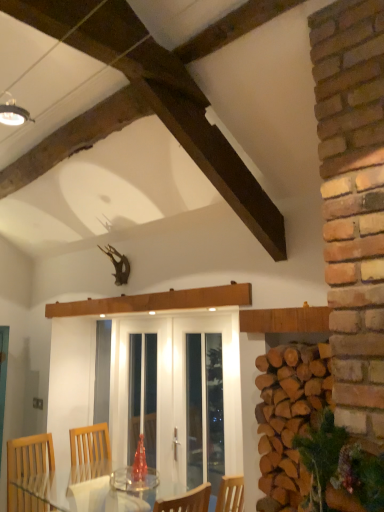
Identify the location of natural brown woodpile at right. (288, 419).

Describe the element at coordinates (204, 396) in the screenshot. I see `white glass door at center, the first screen door viewed from the right` at that location.

I want to click on white glass screen door at center, the 1th screen door positioned from the left, so click(x=178, y=394).

Is natural brown woodpile at right a part of white glass door at center, the first screen door viewed from the right?

No, natural brown woodpile at right is not a part of white glass door at center, the first screen door viewed from the right.

Based on their sizes in the image, would you say white glass door at center, the second screen door in the left-to-right sequence, is bigger or smaller than natural brown woodpile at right?

Considering their sizes, white glass door at center, the second screen door in the left-to-right sequence, takes up less space than natural brown woodpile at right.

From a real-world perspective, which screen door is the 1st one underneath the natural brown woodpile at right? Please provide its 2D coordinates.

[(204, 396)]

Is point (149, 368) less distant than point (288, 357)?

No.

From the picture: How many degrees apart are the facing directions of white glass screen door at center, the 2th screen door viewed from the right, and natural brown woodpile at right?

They differ by 0.137 degrees in their facing directions.

Is white glass screen door at center, the 1th screen door positioned from the left, bigger than natural brown woodpile at right?

Indeed, white glass screen door at center, the 1th screen door positioned from the left, has a larger size compared to natural brown woodpile at right.

Find the location of `screen door above the white glass screen door at center, the 1th screen door positioned from the left (from a real-world perspective)`. screen door above the white glass screen door at center, the 1th screen door positioned from the left (from a real-world perspective) is located at coordinates (204, 396).

Based on the photo, how distant is white glass screen door at center, the 2th screen door viewed from the right, from white glass door at center, the first screen door viewed from the right?

They are 4.84 inches apart.

Between white glass screen door at center, the 2th screen door viewed from the right, and white glass door at center, the first screen door viewed from the right, which one has larger size?

Bigger between the two is white glass screen door at center, the 2th screen door viewed from the right.

From a real-world perspective, is white glass screen door at center, the 2th screen door viewed from the right, on top of white glass door at center, the second screen door in the left-to-right sequence?

No.

Between point (259, 432) and point (225, 324), which one is positioned in front?

The point (259, 432) is closer.

Is there a large distance between natural brown woodpile at right and white glass screen door at center, the 1th screen door positioned from the left?

Absolutely, natural brown woodpile at right is distant from white glass screen door at center, the 1th screen door positioned from the left.

Consider the image. Do you think natural brown woodpile at right is within white glass screen door at center, the 2th screen door viewed from the right, or outside of it?

natural brown woodpile at right is spatially situated outside white glass screen door at center, the 2th screen door viewed from the right.

Which of these two, natural brown woodpile at right or white glass screen door at center, the 1th screen door positioned from the left, stands shorter?

With less height is natural brown woodpile at right.

Does natural brown woodpile at right come in front of white glass door at center, the second screen door in the left-to-right sequence?

Yes, it is in front of white glass door at center, the second screen door in the left-to-right sequence.

Which object is wider, natural brown woodpile at right or white glass door at center, the second screen door in the left-to-right sequence?

Wider between the two is natural brown woodpile at right.

Is natural brown woodpile at right completely or partially outside of white glass door at center, the second screen door in the left-to-right sequence?

natural brown woodpile at right lies outside white glass door at center, the second screen door in the left-to-right sequence,'s area.

At what (x,y) coordinates should I click in order to perform the action: click on screen door above the white glass screen door at center, the 2th screen door viewed from the right (from the image's perspective). Please return your answer as a coordinate pair (x, y). This screenshot has height=512, width=384. Looking at the image, I should click on (204, 396).

Would you say white glass door at center, the second screen door in the left-to-right sequence, is to the left or to the right of white glass screen door at center, the 1th screen door positioned from the left, in the picture?

From the image, it's evident that white glass door at center, the second screen door in the left-to-right sequence, is to the right of white glass screen door at center, the 1th screen door positioned from the left.

Choose the correct answer: Is white glass door at center, the first screen door viewed from the right, inside white glass screen door at center, the 2th screen door viewed from the right, or outside it?

white glass door at center, the first screen door viewed from the right, is enclosed within white glass screen door at center, the 2th screen door viewed from the right.

From a real-world perspective, is white glass door at center, the second screen door in the left-to-right sequence, located beneath white glass screen door at center, the 2th screen door viewed from the right?

Actually, white glass door at center, the second screen door in the left-to-right sequence, is physically above white glass screen door at center, the 2th screen door viewed from the right, in the real world.

Where is `the 1st screen door positioned below the natural brown woodpile at right (from a real-world perspective)`? The image size is (384, 512). the 1st screen door positioned below the natural brown woodpile at right (from a real-world perspective) is located at coordinates (204, 396).

Where is `brickwork that is above the white glass screen door at center, the 1th screen door positioned from the left (from a real-world perspective)`? Image resolution: width=384 pixels, height=512 pixels. brickwork that is above the white glass screen door at center, the 1th screen door positioned from the left (from a real-world perspective) is located at coordinates (288, 419).

Estimate the real-world distances between objects in this image. Which object is closer to white glass door at center, the first screen door viewed from the right, white glass screen door at center, the 1th screen door positioned from the left, or natural brown woodpile at right?

Among the two, white glass screen door at center, the 1th screen door positioned from the left, is located nearer to white glass door at center, the first screen door viewed from the right.

When comparing their distances from white glass screen door at center, the 2th screen door viewed from the right, does natural brown woodpile at right or white glass door at center, the first screen door viewed from the right, seem further?

natural brown woodpile at right lies further to white glass screen door at center, the 2th screen door viewed from the right, than the other object.

When comparing their distances from natural brown woodpile at right, does white glass screen door at center, the 1th screen door positioned from the left, or white glass door at center, the second screen door in the left-to-right sequence, seem closer?

Based on the image, white glass door at center, the second screen door in the left-to-right sequence, appears to be nearer to natural brown woodpile at right.

Which object lies nearer to the anchor point white glass door at center, the second screen door in the left-to-right sequence, natural brown woodpile at right or white glass screen door at center, the 2th screen door viewed from the right?

Among the two, white glass screen door at center, the 2th screen door viewed from the right, is located nearer to white glass door at center, the second screen door in the left-to-right sequence.

Based on their spatial positions, is white glass door at center, the second screen door in the left-to-right sequence, or white glass screen door at center, the 2th screen door viewed from the right, further from natural brown woodpile at right?

Among the two, white glass screen door at center, the 2th screen door viewed from the right, is located further to natural brown woodpile at right.

Based on the photo, from the image, which object appears to be nearer to white glass screen door at center, the 1th screen door positioned from the left, white glass door at center, the first screen door viewed from the right, or natural brown woodpile at right?

Based on the image, white glass door at center, the first screen door viewed from the right, appears to be nearer to white glass screen door at center, the 1th screen door positioned from the left.

The height and width of the screenshot is (512, 384). Identify the location of screen door positioned between natural brown woodpile at right and white glass door at center, the first screen door viewed from the right, from near to far. (178, 394).